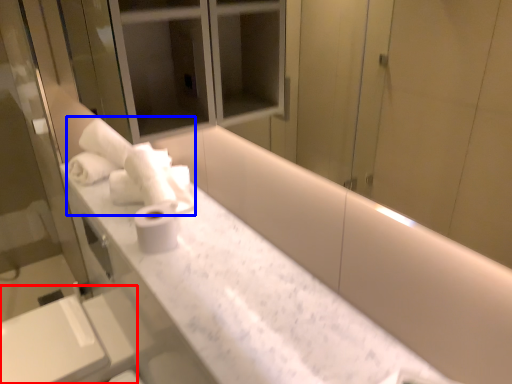
Question: Among these objects, which one is nearest to the camera, sink (highlighted by a red box) or bath towel (highlighted by a blue box)?

Choices:
 (A) sink
 (B) bath towel

Answer: (A)